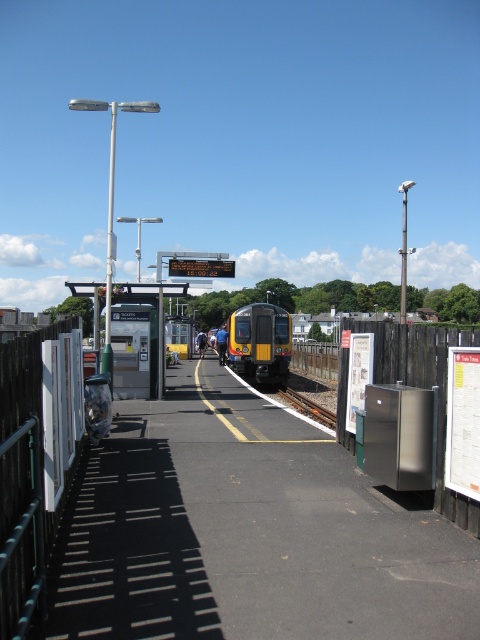
Between yellow matte train at center and brown wooden train track at center, which one has less height?

Standing shorter between the two is brown wooden train track at center.

Can you confirm if yellow matte train at center is positioned to the left of brown wooden train track at center?

Yes, yellow matte train at center is to the left of brown wooden train track at center.

Who is more forward, (244, 356) or (308, 410)?

Point (308, 410) is more forward.

The height and width of the screenshot is (640, 480). I want to click on yellow matte train at center, so click(x=261, y=340).